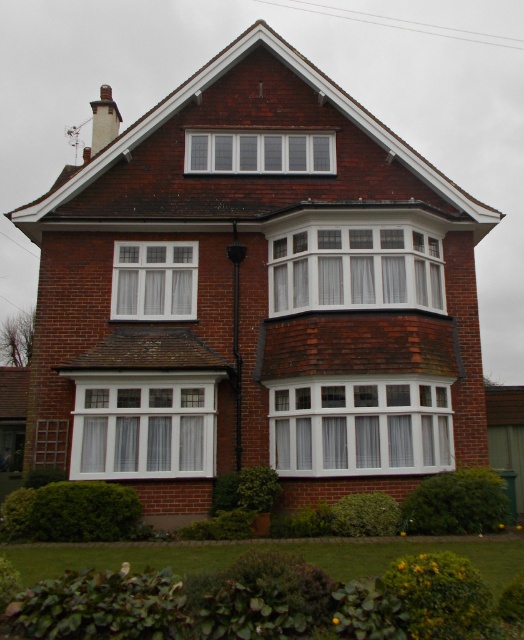
Question: Among these objects, which one is nearest to the camera?

Choices:
 (A) white glass window at upper center
 (B) white wood window at lower left

Answer: (B)

Question: Does white textured bay window at center have a lesser width compared to white glass window at upper center?

Choices:
 (A) yes
 (B) no

Answer: (A)

Question: Does white wood window at center have a lesser width compared to white glass window at center?

Choices:
 (A) yes
 (B) no

Answer: (B)

Question: Does white wood window at center appear on the left side of white textured bay window at center?

Choices:
 (A) no
 (B) yes

Answer: (A)

Question: Which object is the farthest from the white glass window at center?

Choices:
 (A) white wood window at lower left
 (B) white wood window at center

Answer: (B)

Question: Among these points, which one is nearest to the camera?

Choices:
 (A) (285, 406)
 (B) (193, 420)

Answer: (B)